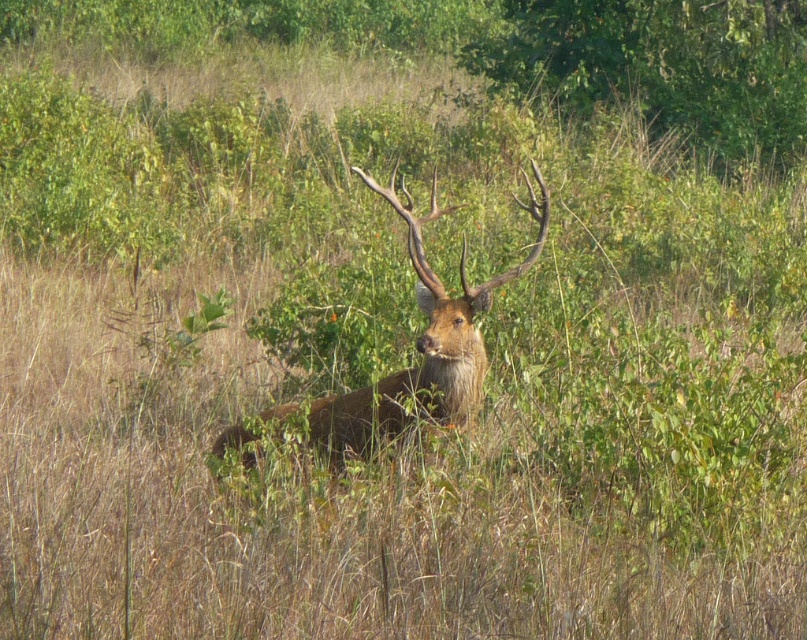
You are a photographer aiming to capture the brown furry deer at center while ensuring the green leafy bush at upper center does not block the view. Based on their positions, is the deer visible without obstruction?

The green leafy bush at upper center is above the brown furry deer at center, so the deer should be visible without obstruction from the bush as it is positioned below.

You are an observer looking at the scene. There is a green leafy bush at upper center and a brown furry deer at center. Which object is located to the right side of the other?

The green leafy bush at upper center is to the right of the brown furry deer at center.